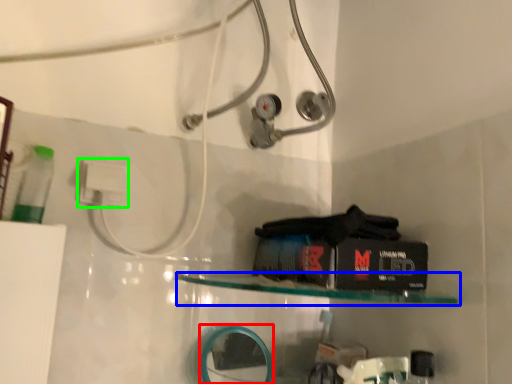
Question: Based on their relative distances, which object is nearer to mirror (highlighted by a red box)? Choose from shelf (highlighted by a blue box) and electric outlet (highlighted by a green box).

Choices:
 (A) shelf
 (B) electric outlet

Answer: (A)